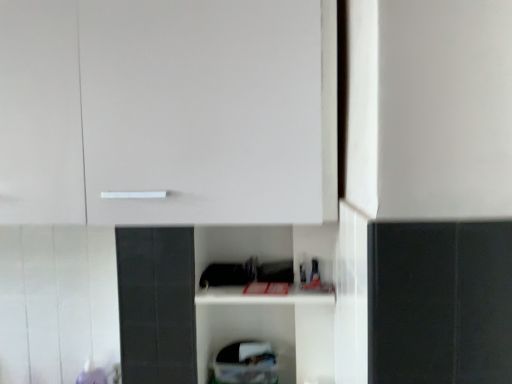
The width and height of the screenshot is (512, 384). What do you see at coordinates (168, 112) in the screenshot? I see `white matte cabinet at upper left` at bounding box center [168, 112].

Measure the distance between point (24, 128) and camera.

The depth of point (24, 128) is 35.71 inches.

Where is `white matte cabinet at upper left`? Image resolution: width=512 pixels, height=384 pixels. white matte cabinet at upper left is located at coordinates (168, 112).

What is the approximate height of white matte cabinet at upper left?

24.10 inches.

What are the coordinates of `white matte cabinet at upper left` in the screenshot? It's located at (168, 112).